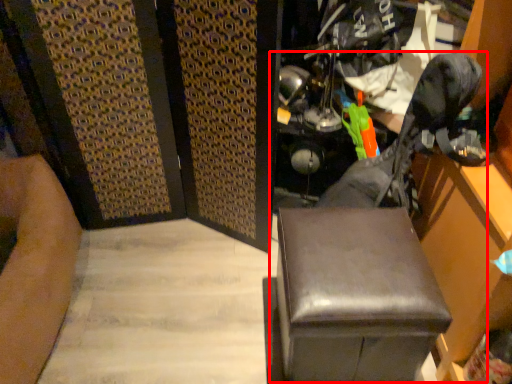
Question: Where is swivel chair (annotated by the red box) located in relation to furniture in the image?

Choices:
 (A) left
 (B) right

Answer: (B)